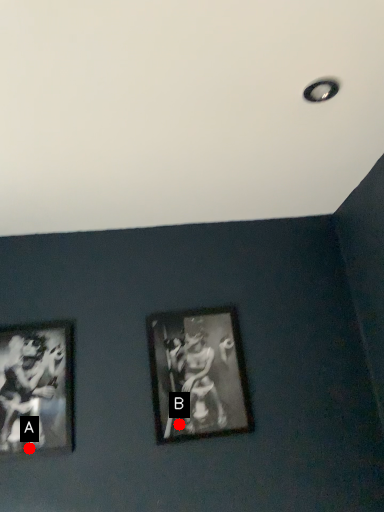
Question: Two points are circled on the image, labeled by A and B beside each circle. Which of the following is the farthest from the observer?

Choices:
 (A) A is further
 (B) B is further

Answer: (B)